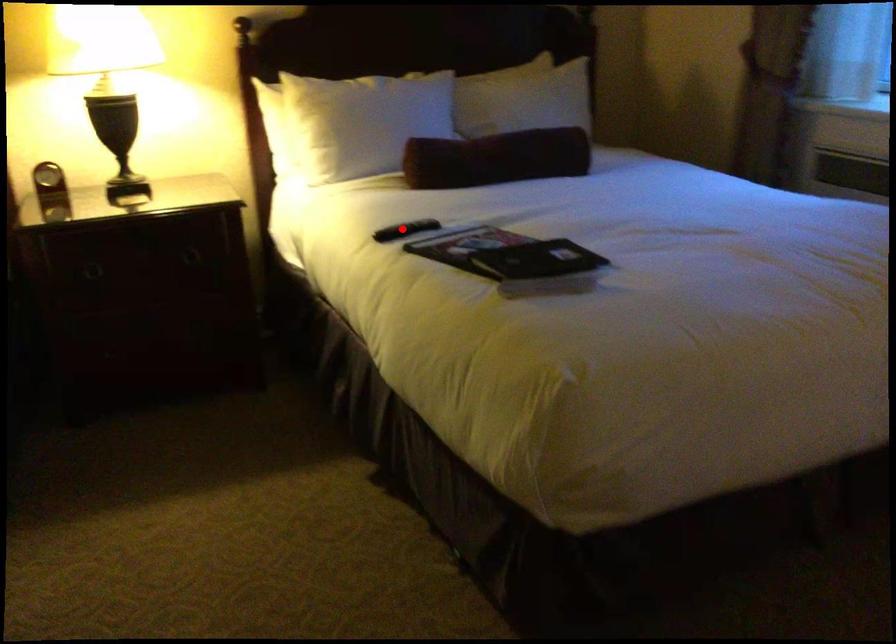
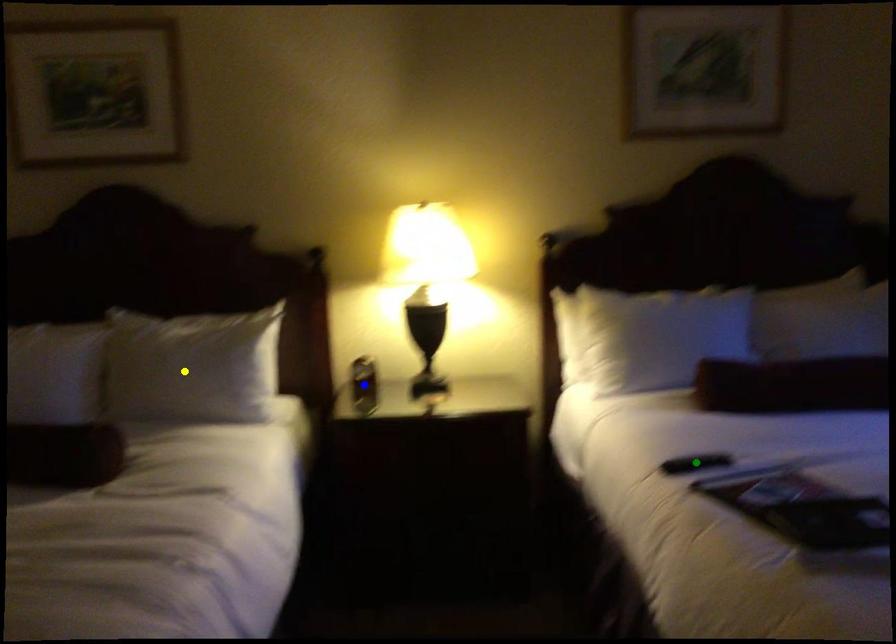
Question: I am providing you with two images of the same scene from different viewpoints. A red point is marked on the first image. You are given multiple points on the second image. Which point in image 2 is actually the same real-world point as the red point in image 1?

Choices:
 (A) green point
 (B) blue point
 (C) yellow point

Answer: (A)